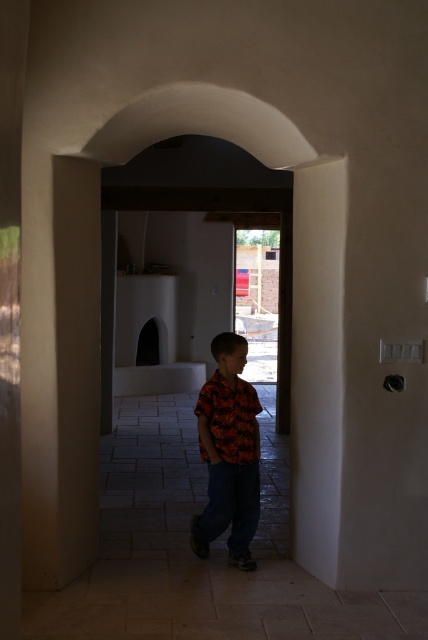
Describe the element at coordinates (59, 369) in the screenshot. Image resolution: width=428 pixels, height=640 pixels. I see `smooth beige pillar at left` at that location.

The image size is (428, 640). I want to click on smooth beige pillar at left, so click(59, 369).

Find the location of a particular element. smooth beige pillar at left is located at coordinates (59, 369).